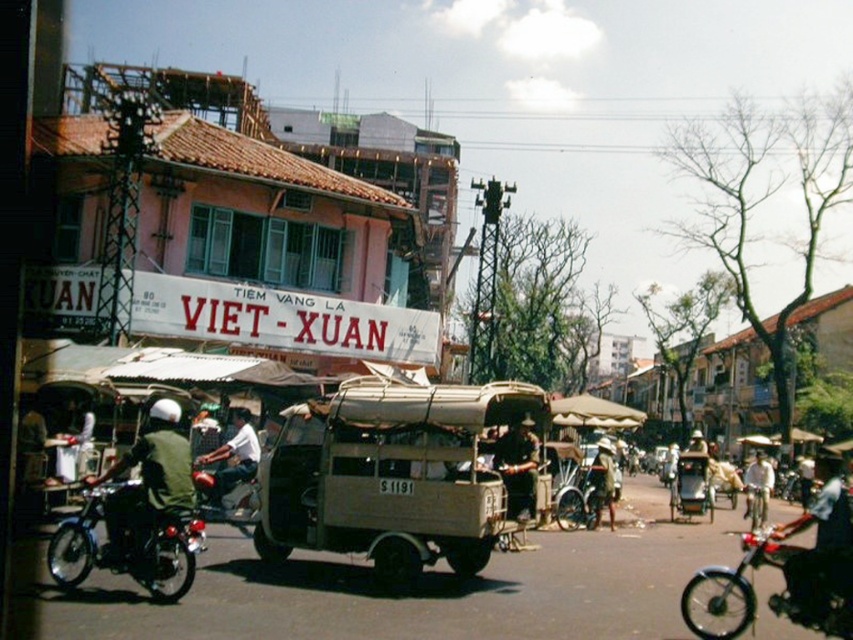
You are a delivery rider who needs to park your shiny black motorcycle at lower left next to the dark brown leather jacket at center. Given that the parking space is only wide enough for one vehicle, will the motorcycle fit alongside the jacket without overlapping?

The shiny black motorcycle at lower left is wider than the dark brown leather jacket at center, so it will not fit alongside the jacket without overlapping in the narrow parking space.

You are a delivery rider who needs to secure a dark brown leather jacket at center onto your shiny black motorcycle at lower left. Considering their sizes, will the jacket fit on the motorcycle?

The shiny black motorcycle at lower left is bigger than the dark brown leather jacket at center, so the jacket will fit on the motorcycle.